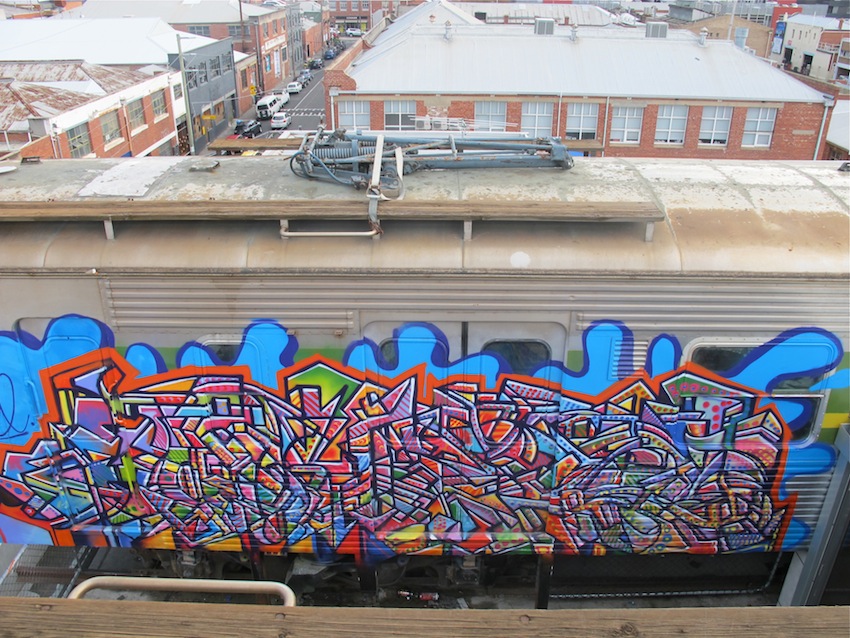
Locate an element on the screen. The height and width of the screenshot is (638, 850). handle is located at coordinates (354, 231).